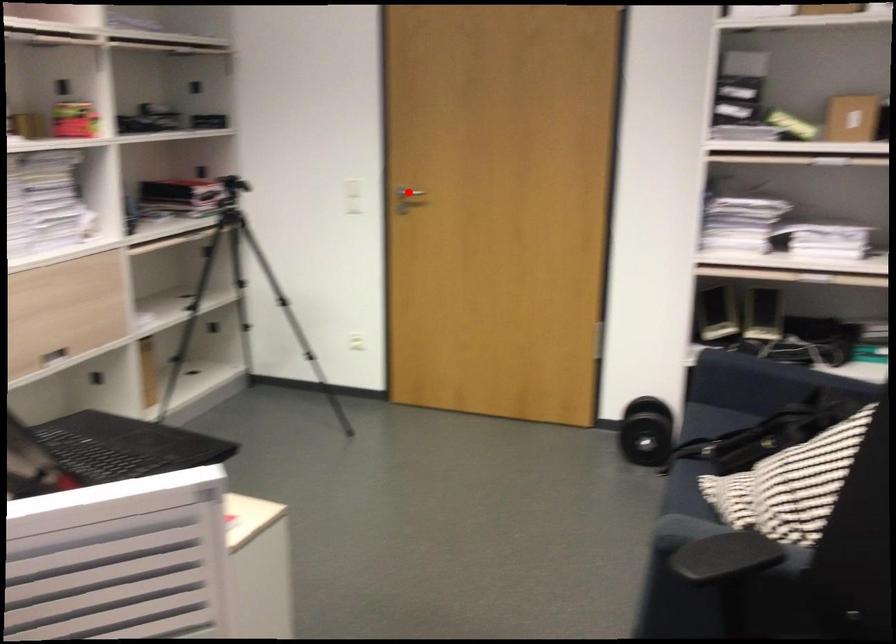
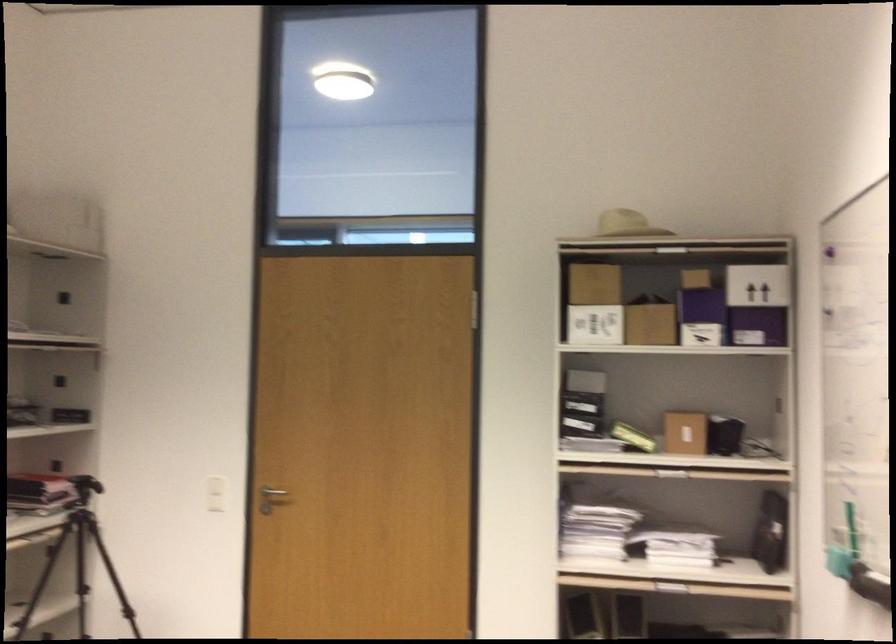
Locate, in the second image, the point that corresponds to the highlighted location in the first image.

(272, 491)